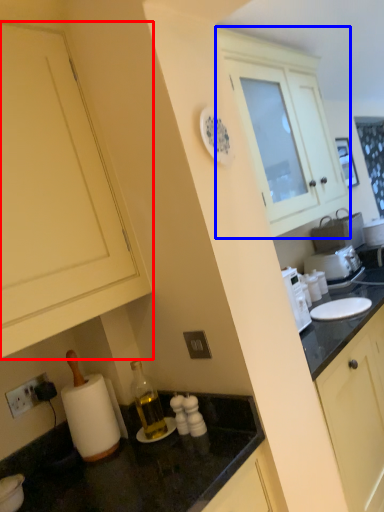
Question: Which point is further to the camera, cabinetry (highlighted by a red box) or cabinetry (highlighted by a blue box)?

Choices:
 (A) cabinetry
 (B) cabinetry

Answer: (B)